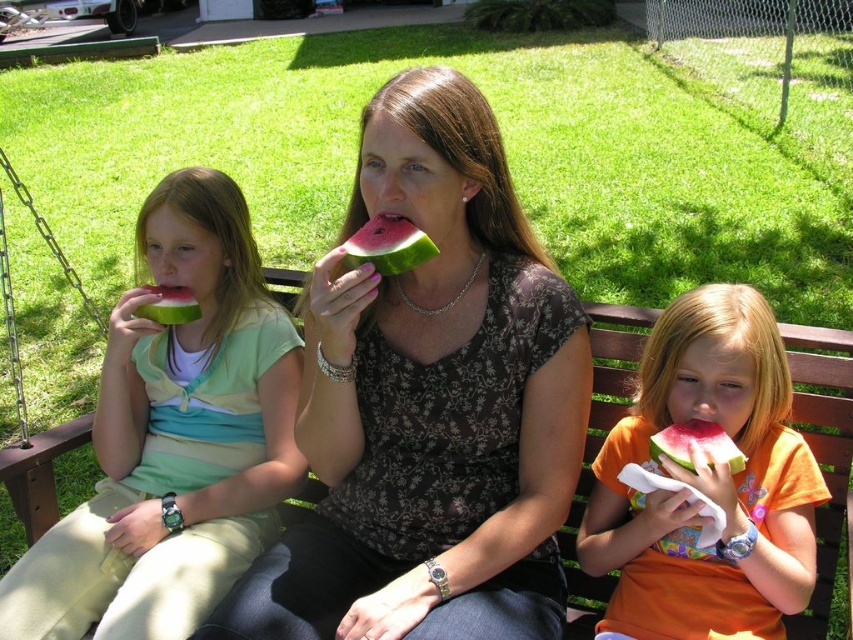
Question: From the image, what is the correct spatial relationship of light green fabric shirt at left in relation to orange cotton shirt at center?

Choices:
 (A) right
 (B) left

Answer: (B)

Question: Is light green fabric shirt at left below metallic chain at left?

Choices:
 (A) yes
 (B) no

Answer: (A)

Question: Which of the following is the closest to the observer?

Choices:
 (A) (738, 294)
 (B) (112, 632)
 (C) (670, 429)

Answer: (C)

Question: Which point is closer to the camera taking this photo?

Choices:
 (A) (381, 260)
 (B) (96, 310)

Answer: (A)

Question: Can you confirm if watermelon at center is thinner than green matte watermelon at left?

Choices:
 (A) no
 (B) yes

Answer: (A)

Question: Which of these objects is positioned farthest from the watermelon at center?

Choices:
 (A) light green fabric shirt at left
 (B) pink flesh watermelon at lower right

Answer: (A)